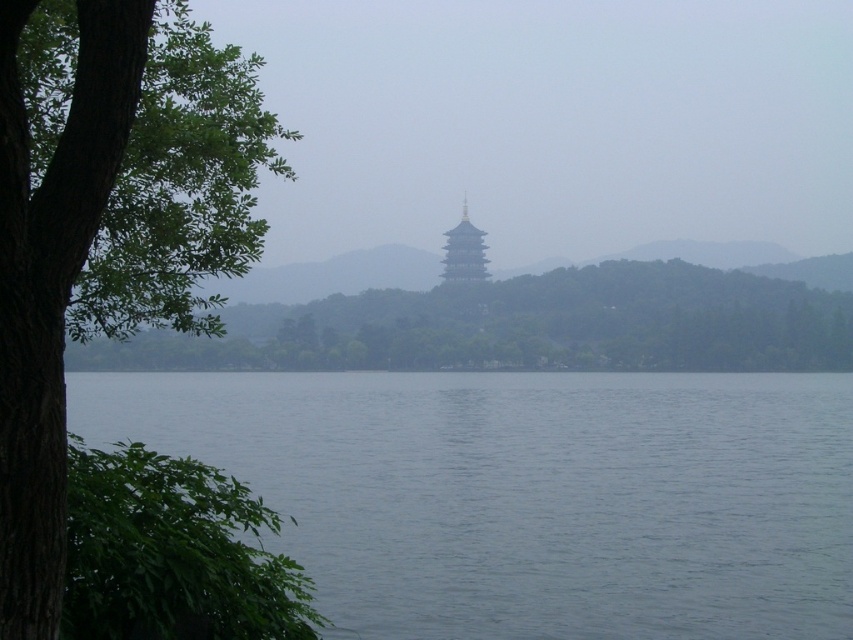
Question: Does gray water at center come in front of green leafy tree at left?

Choices:
 (A) yes
 (B) no

Answer: (B)

Question: Which point appears farthest from the camera in this image?

Choices:
 (A) (410, 355)
 (B) (630, 522)

Answer: (A)

Question: Observing the image, what is the correct spatial positioning of gray water at center in reference to green leafy tree at center?

Choices:
 (A) above
 (B) below

Answer: (B)

Question: Which object appears farthest from the camera in this image?

Choices:
 (A) green leafy tree at center
 (B) gray water at center
 (C) green leafy tree at left

Answer: (A)

Question: Does gray water at center come in front of green leafy tree at left?

Choices:
 (A) yes
 (B) no

Answer: (B)

Question: Which point is closer to the camera?

Choices:
 (A) gray water at center
 (B) green leafy tree at center
 (C) green leafy tree at left

Answer: (C)